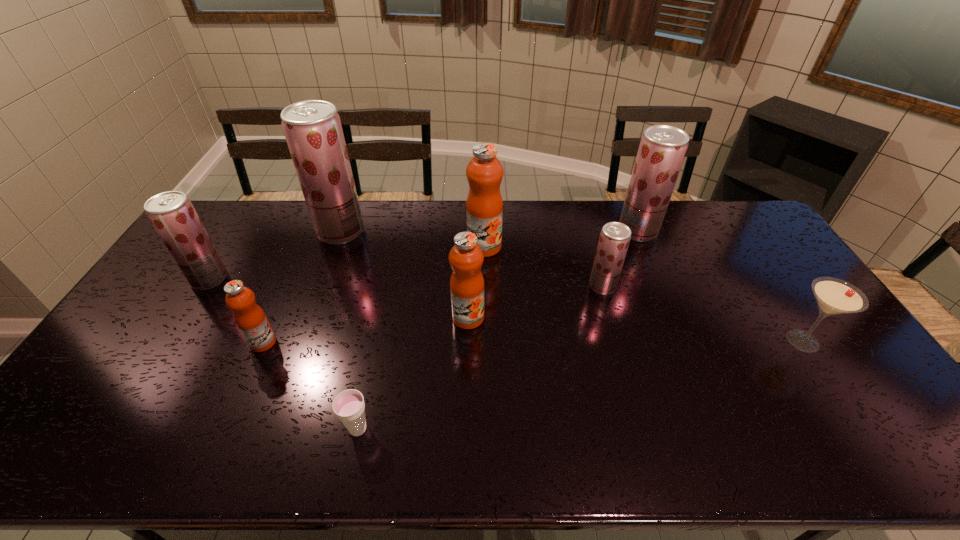
You are a GUI agent. You are given a task and a screenshot of the screen. Output one action in this format:
    pyautogui.click(x=<x>, y=<y>)
    Task: Click on the vacant space located on the front label of the second biggest orange fruit juice
    
    Given the screenshot: What is the action you would take?
    pyautogui.click(x=467, y=362)

Find the location of a particular element. vacant region located on the back of the second strawberry fruit juice from right to left is located at coordinates (590, 244).

Find the location of a particular element. vacant space located 0.080m on the front label of the nearest orange fruit juice is located at coordinates (304, 342).

Identify the location of blank area located 0.320m on the back of the martini. This screenshot has height=540, width=960. (744, 252).

You are a GUI agent. You are given a task and a screenshot of the screen. Output one action in this format:
    pyautogui.click(x=<x>, y=<y>)
    Task: Click on the free space located on the right of the shortest object
    The image size is (960, 540).
    Given the screenshot: What is the action you would take?
    pyautogui.click(x=502, y=429)

Find the location of `object that is positioned at the near edge`. object that is positioned at the near edge is located at coordinates (348, 405).

This screenshot has height=540, width=960. I want to click on object that is at the left edge, so click(171, 213).

The height and width of the screenshot is (540, 960). What are the coordinates of `object at the right edge` in the screenshot? It's located at (834, 296).

In the image, there is a desktop. What are the coordinates of `vacant space at the far edge` in the screenshot? It's located at (696, 211).

This screenshot has width=960, height=540. I want to click on blank area at the near edge, so (650, 436).